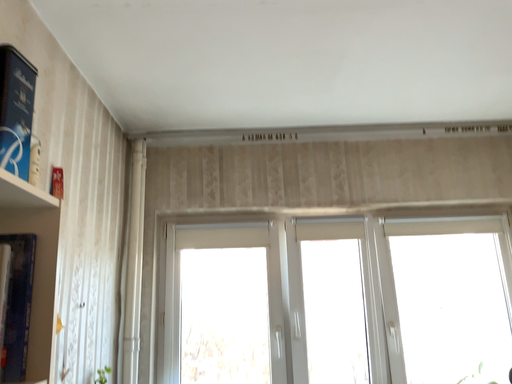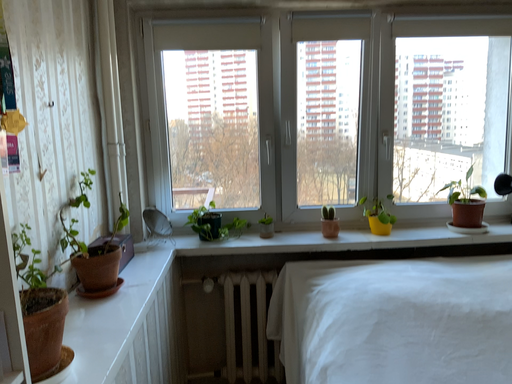
Question: How did the camera likely rotate when shooting the video?

Choices:
 (A) rotated downward
 (B) rotated upward

Answer: (A)